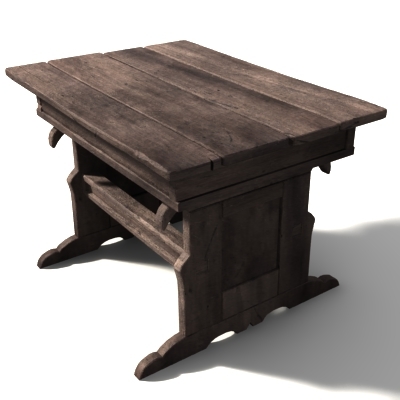
Identify the location of side support of table. This screenshot has width=400, height=400. (146, 219).